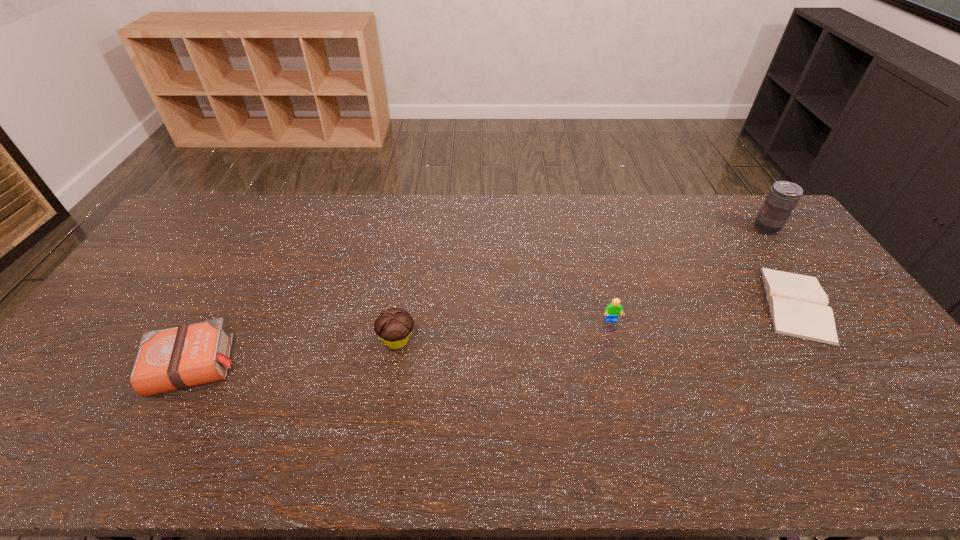
In order to click on vacant space situated 0.330m on the side of the telephoto lens where the control switches are located in this screenshot , I will do `click(659, 228)`.

Where is `vacant space located on the right of the muffin`? vacant space located on the right of the muffin is located at coordinates pyautogui.click(x=530, y=340).

At what (x,y) coordinates should I click in order to perform the action: click on vacant space situated 0.280m on the face of the third object from right to left. Please return your answer as a coordinate pair (x, y). This screenshot has width=960, height=540. Looking at the image, I should click on (636, 416).

This screenshot has width=960, height=540. Find the location of `vacant space located on the right of the leftmost object`. vacant space located on the right of the leftmost object is located at coordinates (336, 366).

Find the location of a particular element. blank space located 0.220m on the back of the shorter Bible is located at coordinates (743, 225).

Identify the location of object that is at the far edge. The image size is (960, 540). (783, 196).

At what (x,y) coordinates should I click in order to perform the action: click on telephoto lens positioned at the right edge. Please return your answer as a coordinate pair (x, y). This screenshot has width=960, height=540. Looking at the image, I should click on (783, 196).

Locate an element on the screen. Image resolution: width=960 pixels, height=540 pixels. Bible present at the right edge is located at coordinates (798, 305).

Image resolution: width=960 pixels, height=540 pixels. Find the location of `object at the far right corner`. object at the far right corner is located at coordinates (783, 196).

Locate an element on the screen. vacant region at the far edge of the desktop is located at coordinates (627, 215).